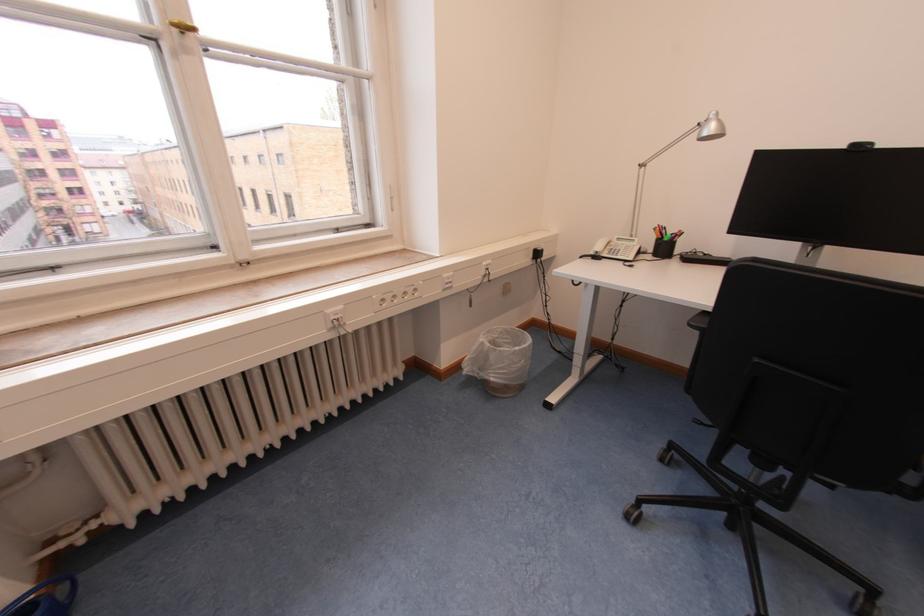
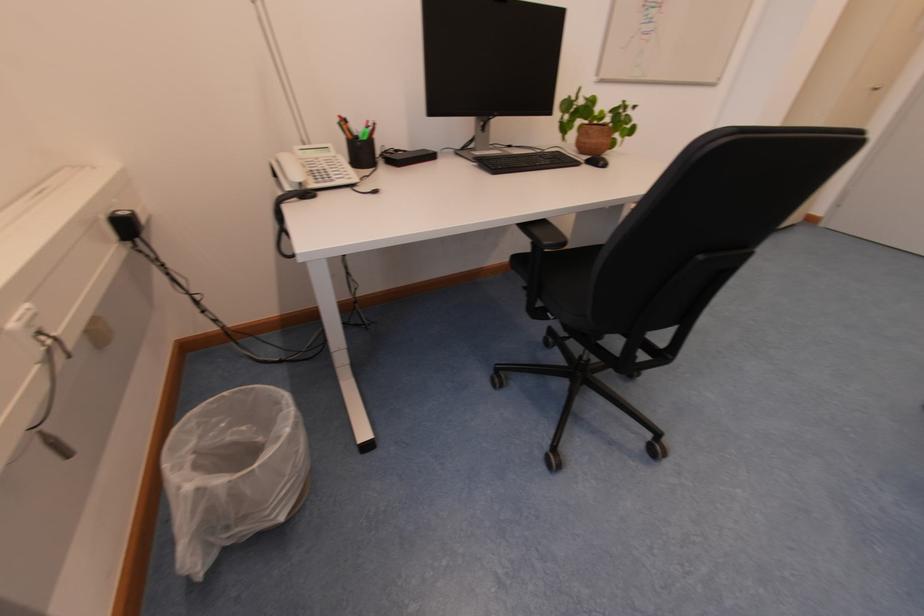
The point at (662, 232) is marked in the first image. Where is the corresponding point in the second image?

(347, 127)